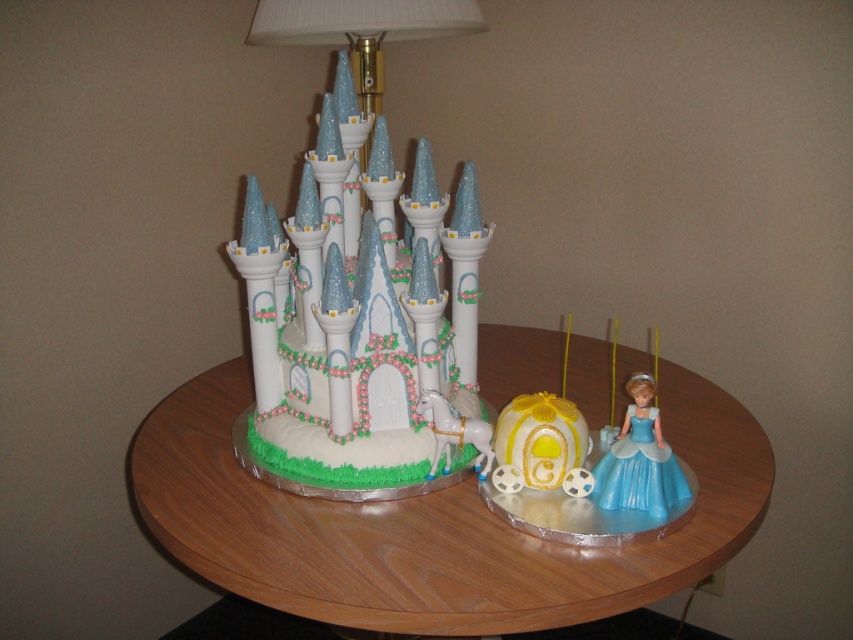
You are standing in front of the image and want to describe the position of the wooden table at center. What are its coordinates?

The wooden table at center is located at coordinates point (430, 525).

You are a caterer setting up for a party and need to place a 12 inch wide cake stand between the white fondant castle at center and the satin blue dress at lower right. Will the cake stand fit in the space between them?

The distance between the white fondant castle at center and the satin blue dress at lower right is 12.34 inches. Since the cake stand is 12 inches wide, it will fit with a small amount of space remaining.